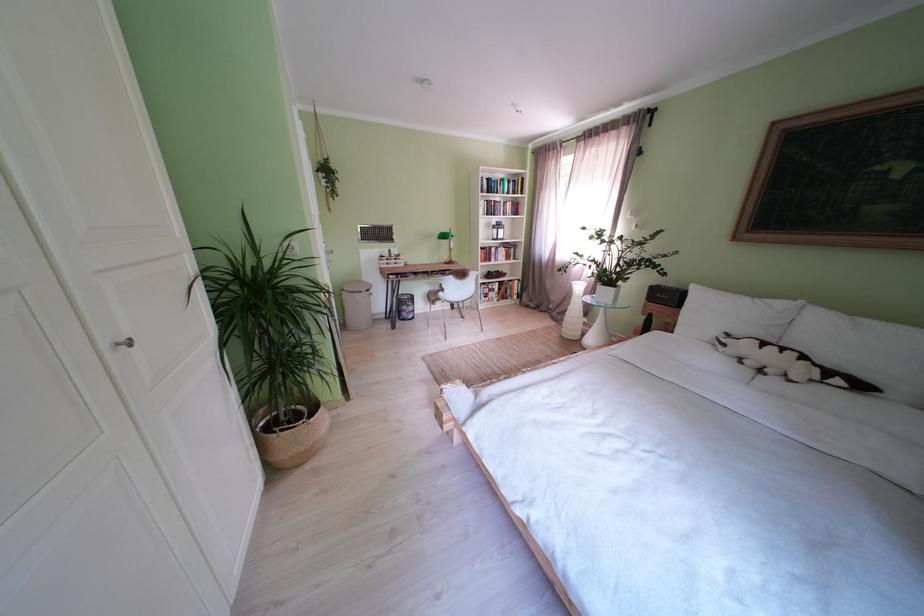
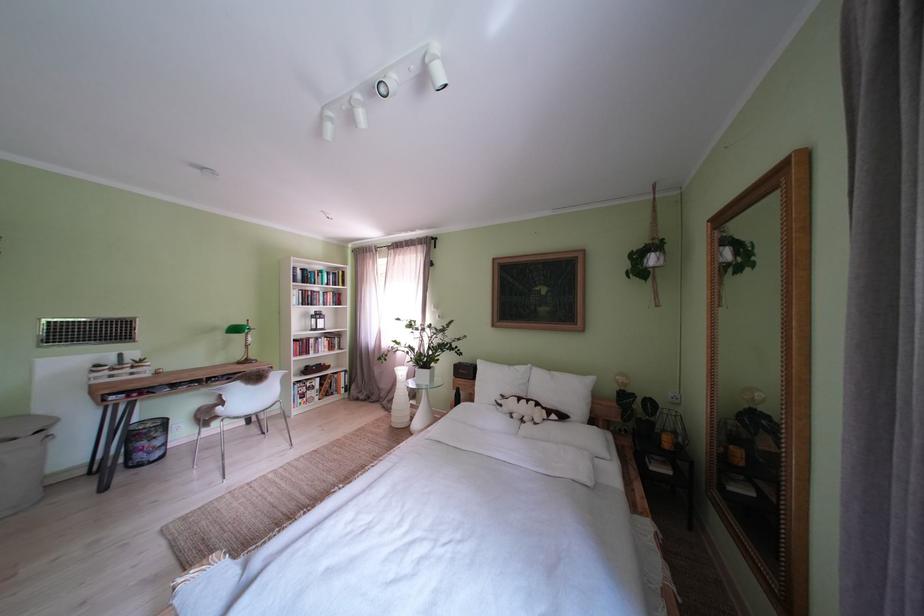
Find the pixel in the second image that matches [716,317] in the first image.

(500, 386)